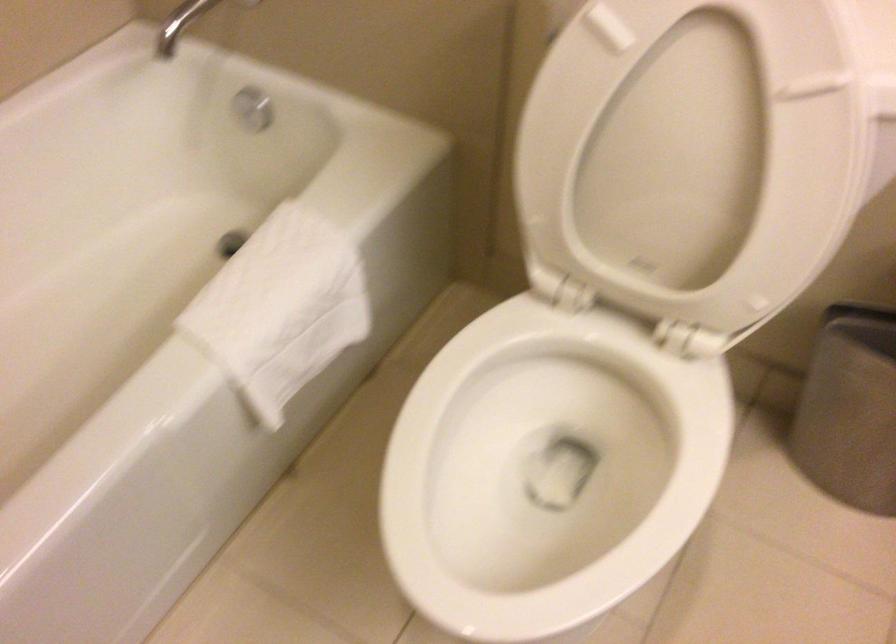
Find the location of a particular element. white toilet lid is located at coordinates (691, 154).